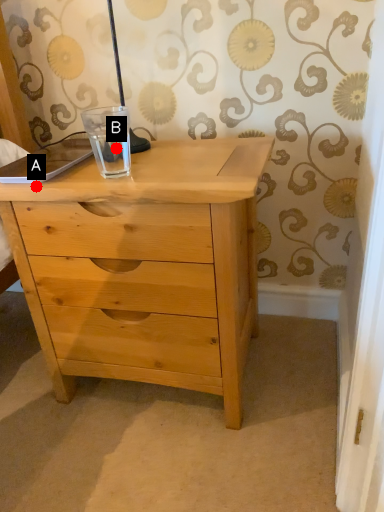
Question: Two points are circled on the image, labeled by A and B beside each circle. Which point is farther from the camera taking this photo?

Choices:
 (A) A is further
 (B) B is further

Answer: (B)